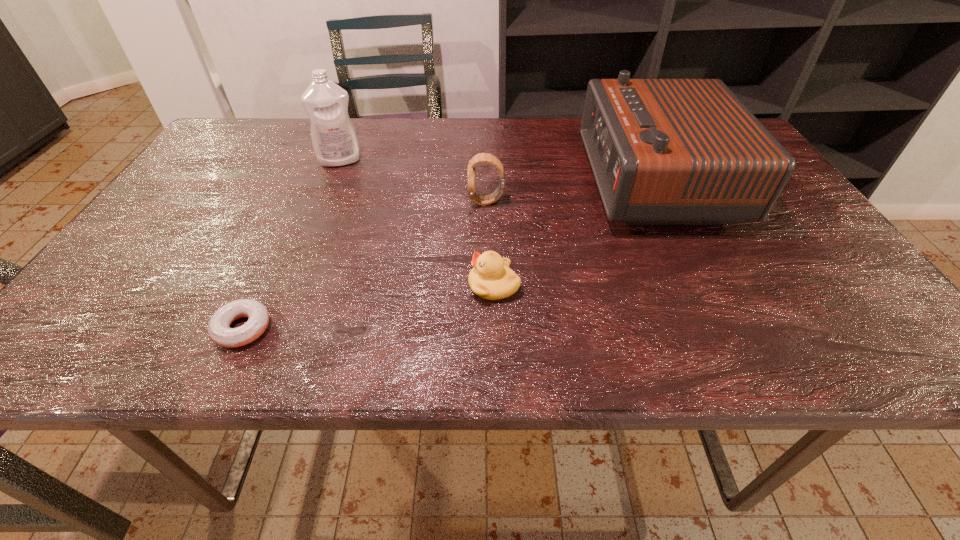
Locate an element on the screen. The image size is (960, 540). blank space that satisfies the following two spatial constraints: 1. on the front-facing side of the fourth tallest object; 2. on the front side of the shortest object is located at coordinates (495, 328).

At what (x,y) coordinates should I click in order to perform the action: click on vacant area in the image that satisfies the following two spatial constraints: 1. on the back side of the doughnut; 2. on the left side of the detergent. Please return your answer as a coordinate pair (x, y). The width and height of the screenshot is (960, 540). Looking at the image, I should click on (322, 160).